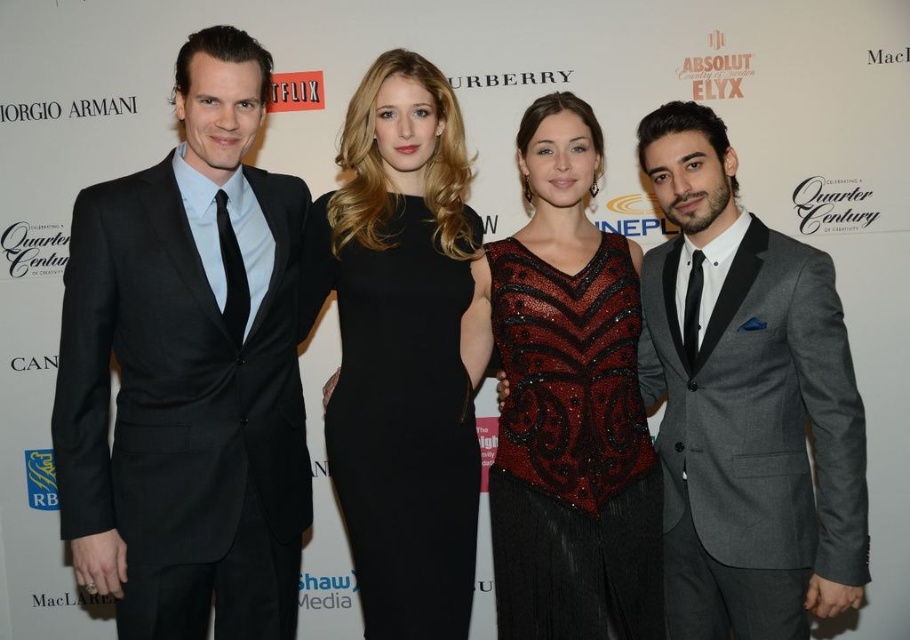
Can you confirm if black satin dress at center is wider than shiny sequined top at center?

No, black satin dress at center is not wider than shiny sequined top at center.

Identify the location of black satin dress at center. The image size is (910, 640). (402, 349).

In the scene shown: Does black satin suit at left appear under black satin dress at center?

Yes.

Which is behind, point (256, 401) or point (376, 250)?

The point (376, 250) is more distant.

Find the location of a particular element. black satin suit at left is located at coordinates (188, 371).

Does gray wool suit at right come in front of shiny sequined top at center?

Yes, gray wool suit at right is closer to the viewer.

Can you confirm if gray wool suit at right is thinner than shiny sequined top at center?

Correct, gray wool suit at right's width is less than shiny sequined top at center's.

Is point (679, 481) farther from viewer compared to point (614, 368)?

That is True.

Where is `gray wool suit at right`? This screenshot has width=910, height=640. gray wool suit at right is located at coordinates (745, 403).